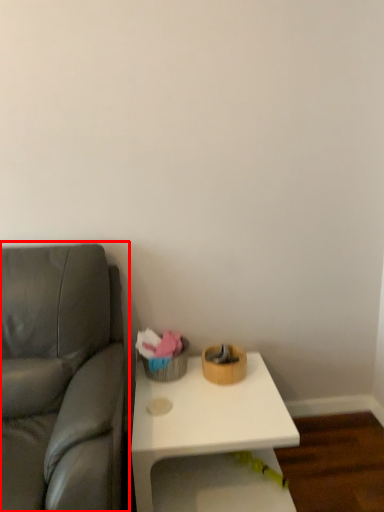
Question: Considering the relative positions of studio couch (annotated by the red box) and table in the image provided, where is studio couch (annotated by the red box) located with respect to the staircase?

Choices:
 (A) right
 (B) left

Answer: (B)